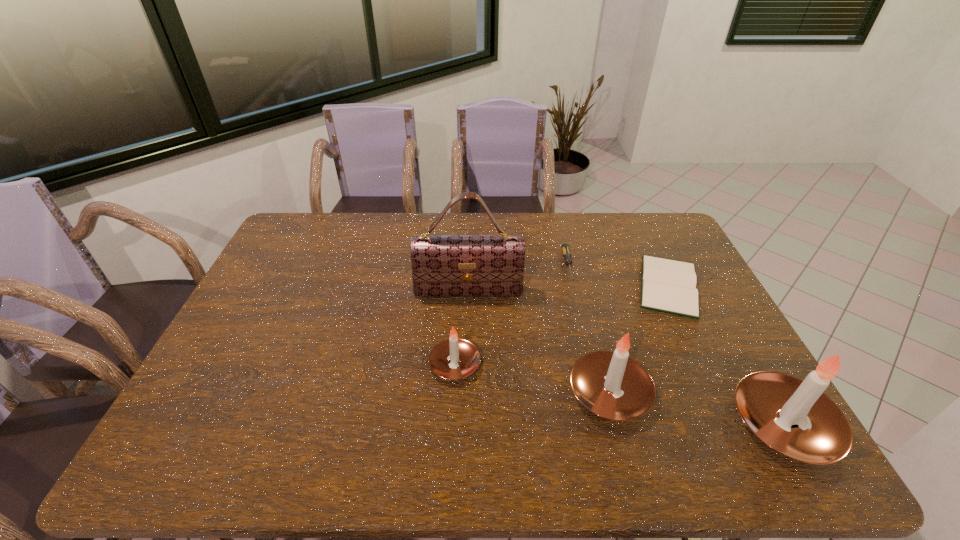
Identify which candle is the closest to the handbag. Please provide its 2D coordinates. Your answer should be formatted as a tuple, i.e. [(x, y)], where the tuple contains the x and y coordinates of a point satisfying the conditions above.

[(454, 358)]

Locate an element on the screen. The height and width of the screenshot is (540, 960). candle identified as the second closest to the rightmost candle is located at coordinates (454, 358).

At what (x,y) coordinates should I click in order to perform the action: click on vacant space that satisfies the following two spatial constraints: 1. insert the screwdriver into a screw head; 2. on the left side of the second candle from right to left. Please return your answer as a coordinate pair (x, y). The width and height of the screenshot is (960, 540). Looking at the image, I should click on (598, 393).

You are a GUI agent. You are given a task and a screenshot of the screen. Output one action in this format:
    pyautogui.click(x=<x>, y=<y>)
    Task: Click on the free space that satisfies the following two spatial constraints: 1. insert the rightmost candle into a screw head; 2. on the left side of the screwdriver
    
    Given the screenshot: What is the action you would take?
    pyautogui.click(x=606, y=424)

You are a GUI agent. You are given a task and a screenshot of the screen. Output one action in this format:
    pyautogui.click(x=<x>, y=<y>)
    Task: Click on the blank area in the image that satisfies the following two spatial constraints: 1. on the front of the rightmost candle with the clasp; 2. on the right side of the handbag
    
    Given the screenshot: What is the action you would take?
    pyautogui.click(x=465, y=424)